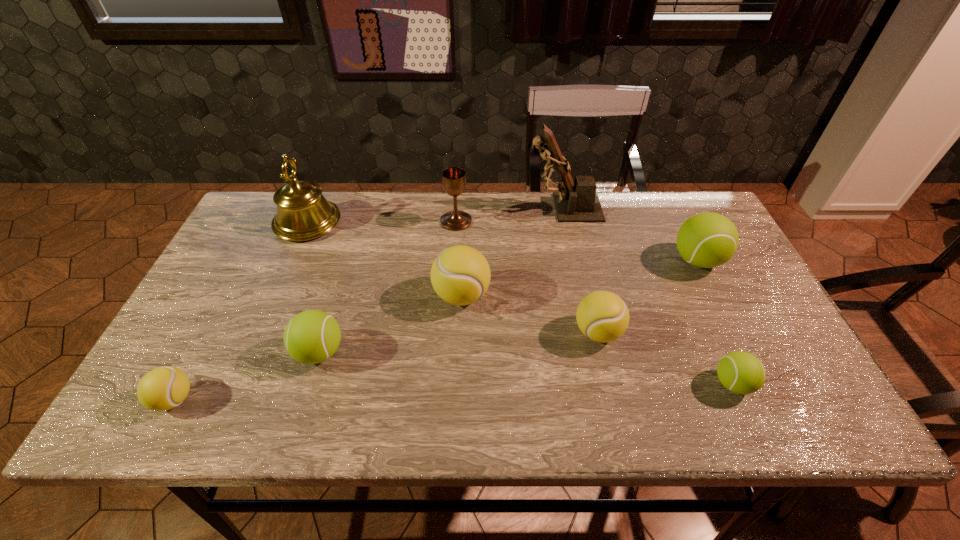
Identify which yellow tennis ball is located as the second nearest to the biggest green tennis ball. Please provide its 2D coordinates. Your answer should be formatted as a tuple, i.e. [(x, y)], where the tuple contains the x and y coordinates of a point satisfying the conditions above.

[(460, 275)]

Identify which green tennis ball is the nearest to the biggest yellow tennis ball. Please provide its 2D coordinates. Your answer should be formatted as a tuple, i.e. [(x, y)], where the tuple contains the x and y coordinates of a point satisfying the conditions above.

[(313, 336)]

Identify which green tennis ball is located as the second nearest to the leftmost green tennis ball. Please provide its 2D coordinates. Your answer should be formatted as a tuple, i.e. [(x, y)], where the tuple contains the x and y coordinates of a point satisfying the conditions above.

[(706, 240)]

The image size is (960, 540). Identify the location of free point that satisfies the following two spatial constraints: 1. on the front side of the chalice; 2. on the left side of the second smallest yellow tennis ball. (449, 332).

Identify the location of vacant space that satisfies the following two spatial constraints: 1. on the front side of the chalice; 2. on the right side of the rightmost yellow tennis ball. This screenshot has width=960, height=540. (449, 332).

This screenshot has height=540, width=960. I want to click on free spot that satisfies the following two spatial constraints: 1. on the front-facing side of the smallest green tennis ball; 2. on the right side of the brown figurine, so click(602, 384).